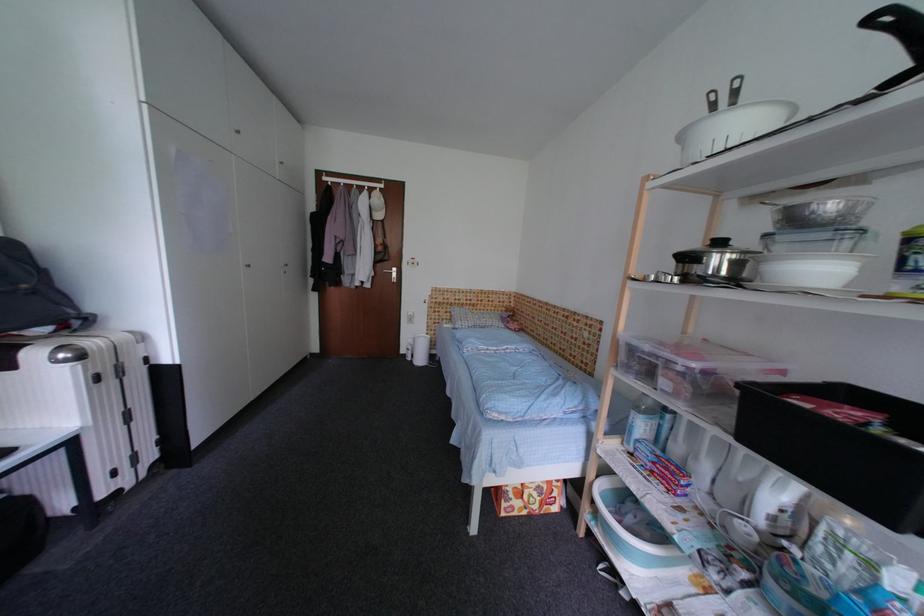
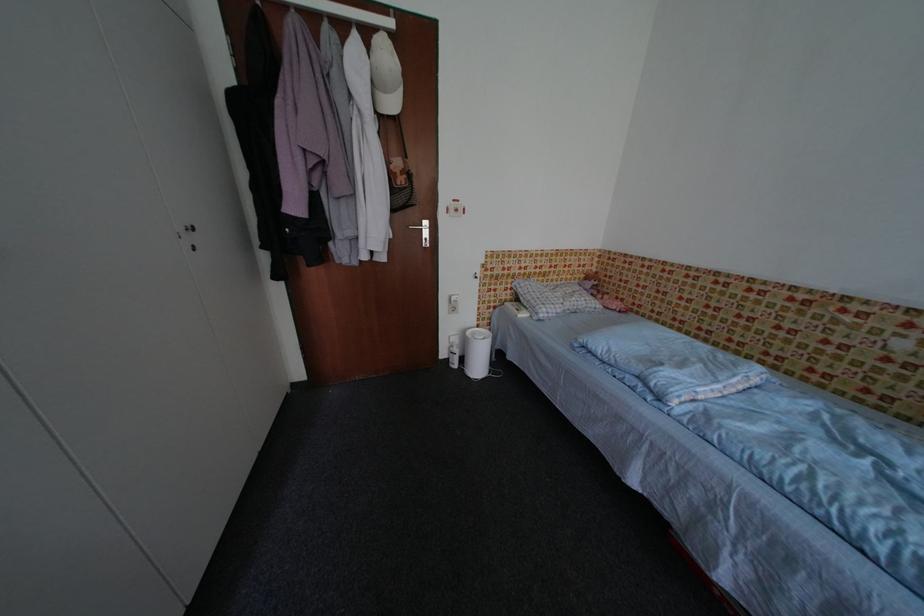
Find the pixel in the second image that matches the point at 387,217 in the first image.

(400, 107)